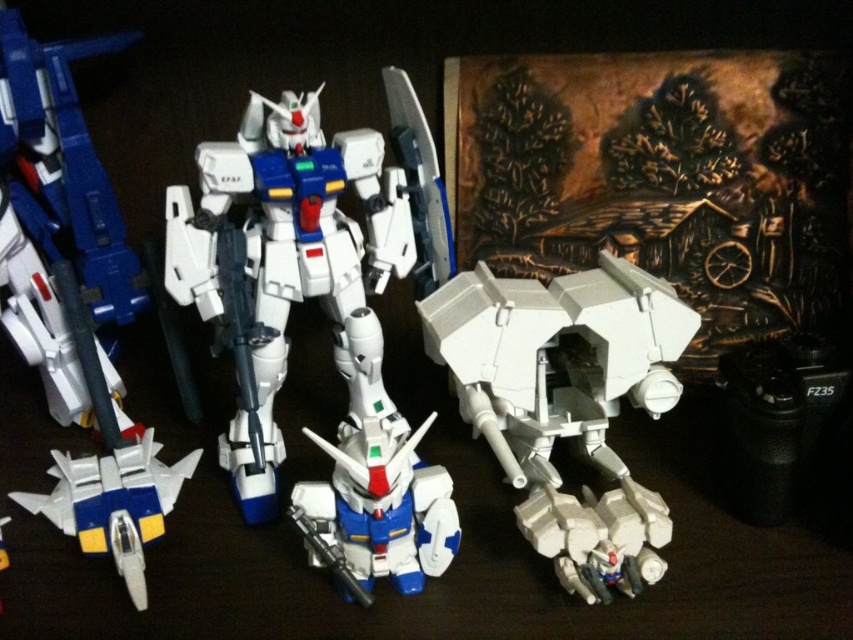
Is white plastic tank at center to the right of shiny white robot at center from the viewer's perspective?

Correct, you'll find white plastic tank at center to the right of shiny white robot at center.

Measure the distance between white plastic tank at center and camera.

31.66 inches

Locate an element on the screen. This screenshot has height=640, width=853. white plastic tank at center is located at coordinates (566, 403).

At what (x,y) coordinates should I click in order to perform the action: click on white plastic robot at center. Please return your answer as a coordinate pair (x, y). The width and height of the screenshot is (853, 640). Looking at the image, I should click on (303, 257).

Based on the photo, is white plastic robot at center wider than shiny white robot at center?

Indeed, white plastic robot at center has a greater width compared to shiny white robot at center.

Is point (358, 232) farther from viewer compared to point (358, 496)?

Yes, point (358, 232) is behind point (358, 496).

What are the coordinates of `white plastic robot at center` in the screenshot? It's located at (303, 257).

Can you confirm if white plastic tank at center is smaller than white plastic jet at lower left?

No, white plastic tank at center is not smaller than white plastic jet at lower left.

Between white plastic tank at center and white plastic jet at lower left, which one has more height?

white plastic tank at center

In order to click on white plastic tank at center in this screenshot , I will do `click(566, 403)`.